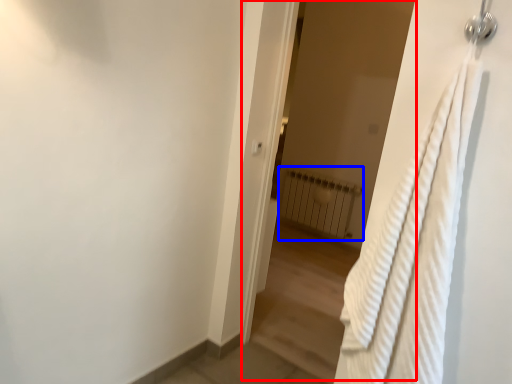
Question: Which point is closer to the camera, screen door (highlighted by a red box) or radiator (highlighted by a blue box)?

Choices:
 (A) screen door
 (B) radiator

Answer: (A)